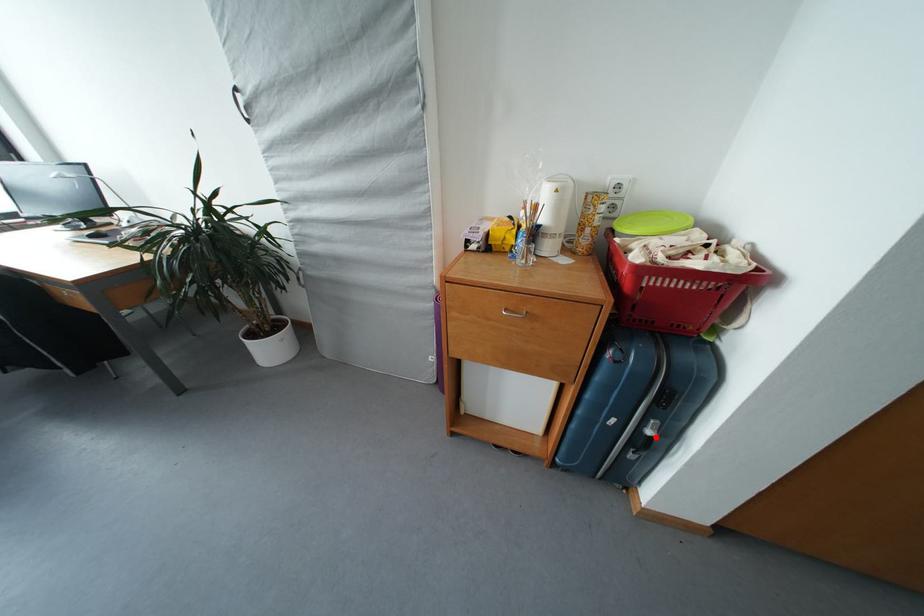
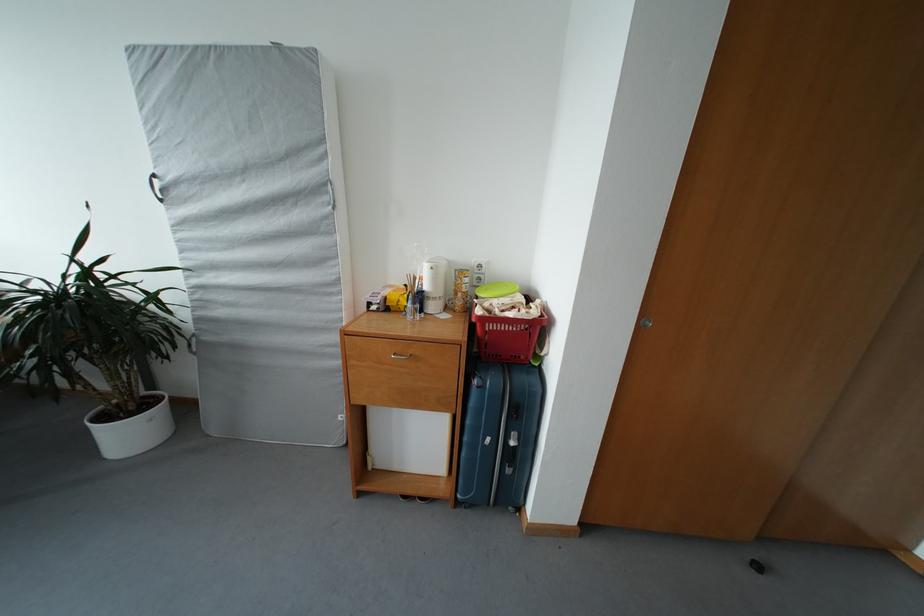
Question: I am providing you with two images of the same scene from different viewpoints. A red point is shown in image1. For the corresponding object point in image2, is it positioned nearer or farther from the camera?

Choices:
 (A) Nearer
 (B) Farther

Answer: (B)